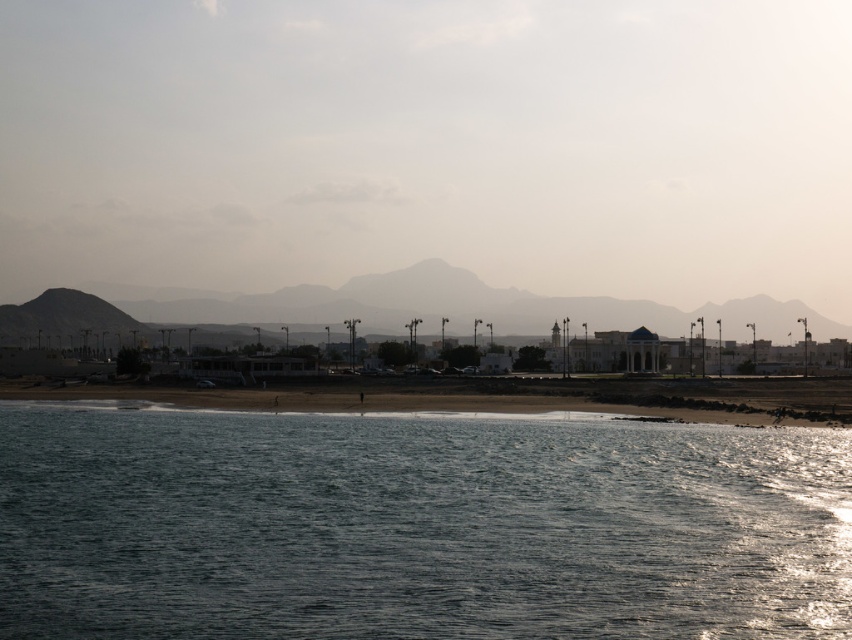
Question: Is shiny blue water at center bigger than sandy brown mountain at center?

Choices:
 (A) no
 (B) yes

Answer: (A)

Question: Which object is the closest to the sandy beach at lower center?

Choices:
 (A) sandy brown mountain at center
 (B) shiny blue water at center

Answer: (B)

Question: Which object appears farthest from the camera in this image?

Choices:
 (A) sandy brown mountain at center
 (B) sandy beach at lower center
 (C) shiny blue water at center

Answer: (A)

Question: Can you confirm if shiny blue water at center is thinner than sandy beach at lower center?

Choices:
 (A) no
 (B) yes

Answer: (B)

Question: Which of the following is the closest to the observer?

Choices:
 (A) (482, 600)
 (B) (697, 381)
 (C) (235, 320)

Answer: (A)

Question: Can you confirm if shiny blue water at center is thinner than sandy beach at lower center?

Choices:
 (A) yes
 (B) no

Answer: (A)